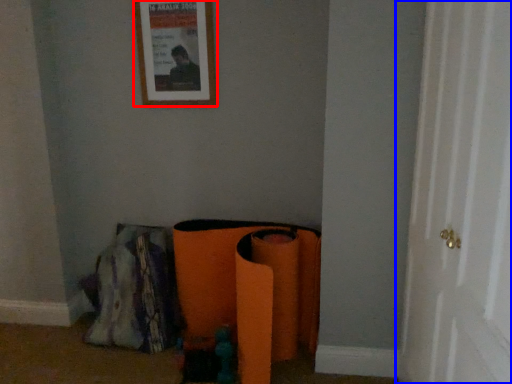
Question: Which object appears closest to the camera in this image, picture frame (highlighted by a red box) or door (highlighted by a blue box)?

Choices:
 (A) picture frame
 (B) door

Answer: (B)